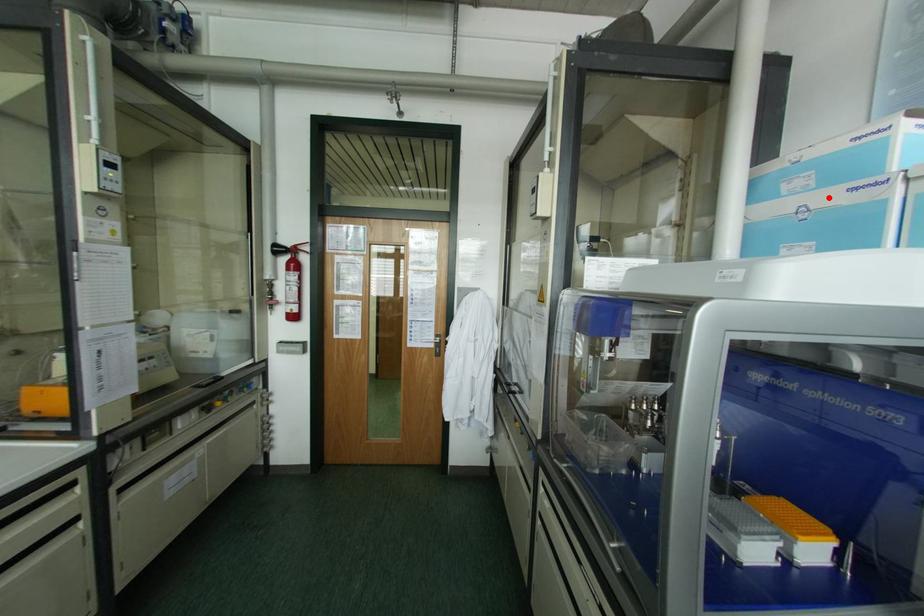
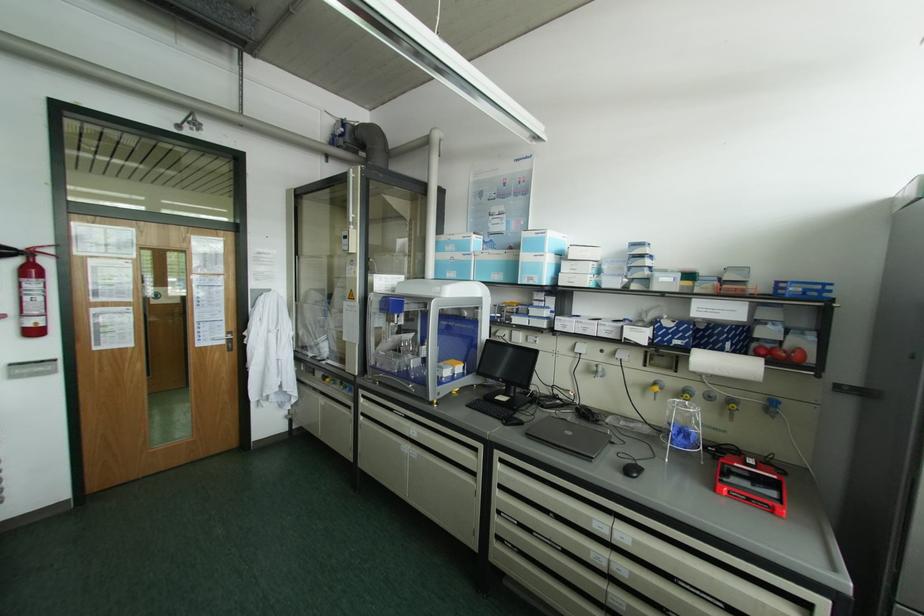
Find the pixel in the second image that matches the highlighted location in the first image.

(457, 256)